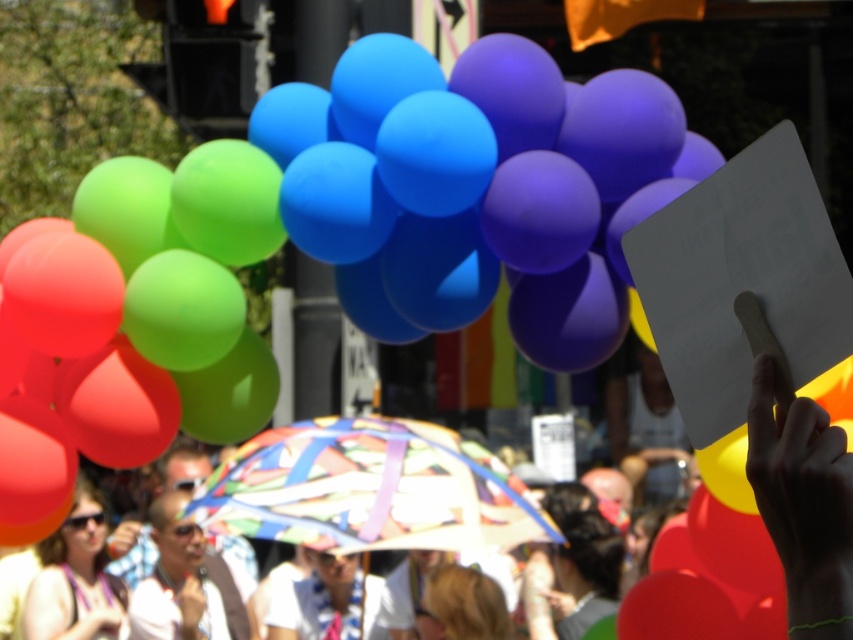
Question: Which point appears closest to the camera in this image?

Choices:
 (A) click(x=378, y=80)
 (B) click(x=850, y=538)

Answer: (B)

Question: Which point appears closest to the camera in this image?

Choices:
 (A) (117, 365)
 (B) (88, 250)

Answer: (B)

Question: From the image, what is the correct spatial relationship of rubber balloons at upper center in relation to white shirt at center?

Choices:
 (A) above
 (B) below

Answer: (A)

Question: In this image, where is rubber balloons at upper center located relative to matte black sunglasses at lower left?

Choices:
 (A) right
 (B) left

Answer: (A)

Question: Observing the image, what is the correct spatial positioning of rubber balloons at upper center in reference to matte black sunglasses at lower left?

Choices:
 (A) below
 (B) above

Answer: (B)

Question: Which of the following is the closest to the observer?

Choices:
 (A) white shirt at center
 (B) rubber balloons at upper center
 (C) matte black sunglasses at lower left

Answer: (B)